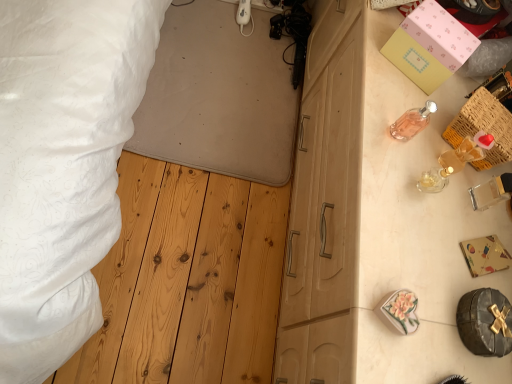
Where is `free spot in front of gold foil gift box at right, the 2th box viewed from the back`? This screenshot has height=384, width=512. free spot in front of gold foil gift box at right, the 2th box viewed from the back is located at coordinates (447, 303).